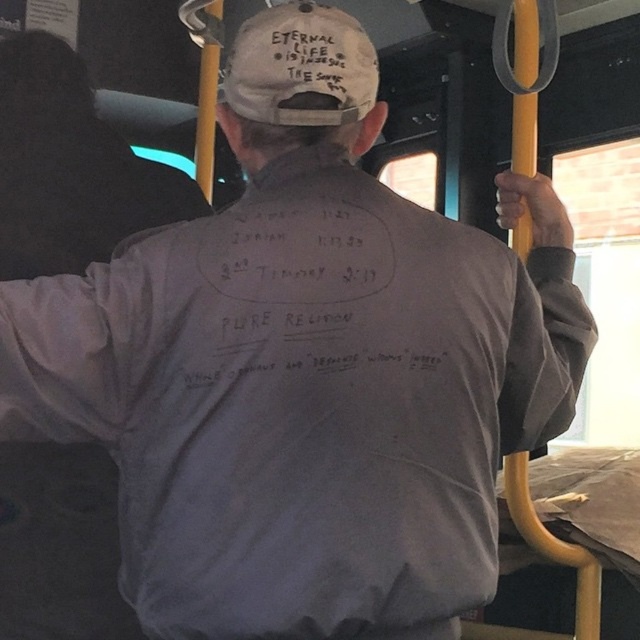
Question: Is gray cotton sweatshirt at upper left smaller than white fabric cap at upper center?

Choices:
 (A) yes
 (B) no

Answer: (B)

Question: Where is gray cotton sweatshirt at upper left located in relation to white fabric cap at upper center in the image?

Choices:
 (A) right
 (B) left

Answer: (B)

Question: Which point is closer to the camera?

Choices:
 (A) gray cotton sweatshirt at upper left
 (B) white fabric cap at upper center

Answer: (B)

Question: Does gray cotton sweatshirt at upper left have a lesser width compared to white fabric cap at upper center?

Choices:
 (A) yes
 (B) no

Answer: (B)

Question: Which object is closer to the camera taking this photo?

Choices:
 (A) gray cotton sweatshirt at upper left
 (B) white fabric cap at upper center

Answer: (B)